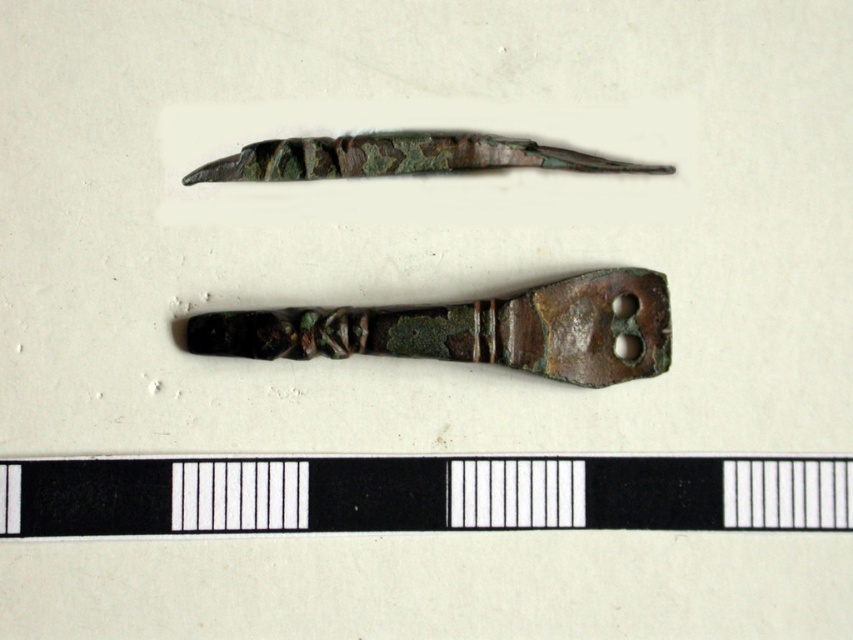
You are an archaeologist examining two artifacts in a museum display. You have a 10 cm wide box to store one of them. The artifacts are the black matte ruler at bottom and the rusty bronze handle at center. Based on their sizes, which artifact can fit into the box?

The black matte ruler at bottom might be wider than rusty bronze handle at center, so the rusty bronze handle at center is more likely to fit into the 10 cm wide box since it is narrower.

You are an archaeologist examining the two artifacts. The black matte ruler at bottom and the rusty bronze handle at center are positioned in a specific way. Which artifact is located to the left of the other?

The black matte ruler at bottom is to the left of the rusty bronze handle at center according to the description.